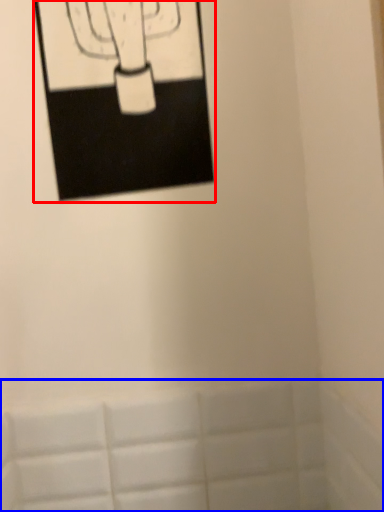
Question: Which object is closer to the camera taking this photo, picture frame (highlighted by a red box) or bath (highlighted by a blue box)?

Choices:
 (A) picture frame
 (B) bath

Answer: (A)